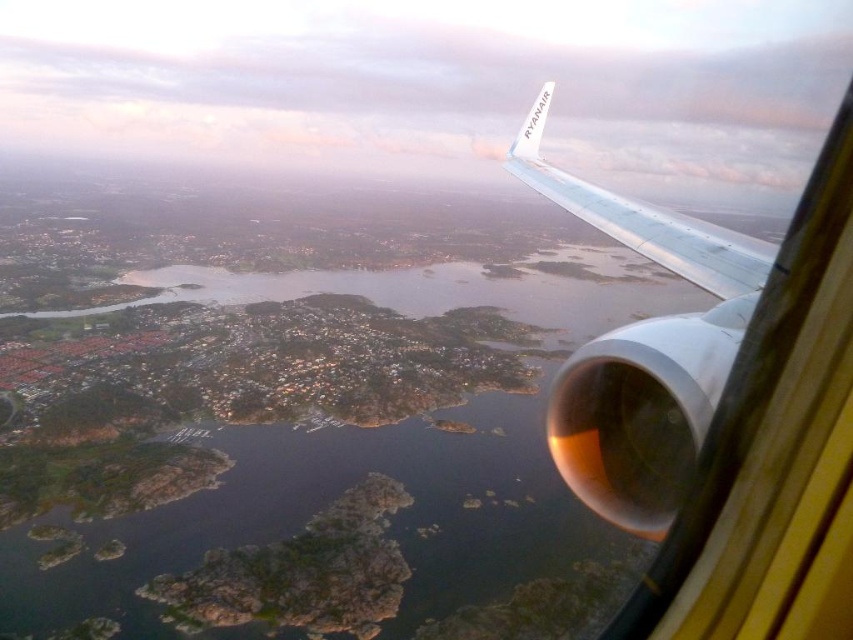
You are a passenger sitting in the airplane and looking out the window. You notice two wings at the upper right of your view. Which wing, the metallic silver wing at upper right or the white metallic wing at upper right, is closer to you?

The metallic silver wing at upper right is closer to you because it is in front of the white metallic wing at upper right.